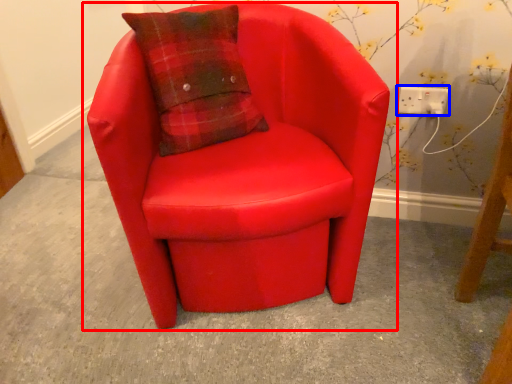
Question: Among these objects, which one is nearest to the camera, chair (highlighted by a red box) or electric outlet (highlighted by a blue box)?

Choices:
 (A) chair
 (B) electric outlet

Answer: (A)